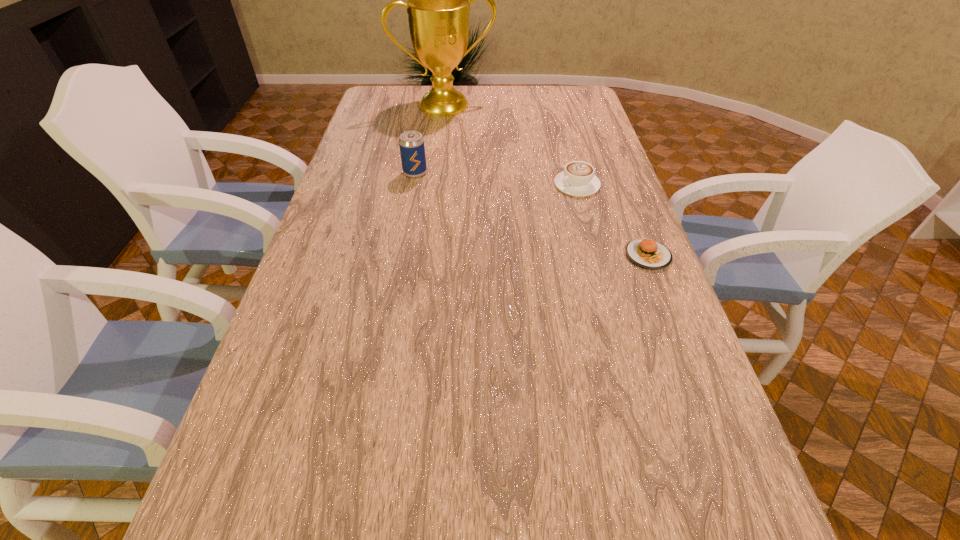
Where is `free space at the far edge of the desktop`? This screenshot has width=960, height=540. free space at the far edge of the desktop is located at coordinates (548, 87).

Where is `free spot at the near edge of the desktop`? The height and width of the screenshot is (540, 960). free spot at the near edge of the desktop is located at coordinates (602, 485).

At what (x,y) coordinates should I click in order to perform the action: click on vacant space at the left edge of the desktop. Please return your answer as a coordinate pair (x, y). The width and height of the screenshot is (960, 540). Looking at the image, I should click on (381, 145).

At what (x,y) coordinates should I click in order to perform the action: click on vacant region at the right edge of the desktop. Please return your answer as a coordinate pair (x, y). Looking at the image, I should click on 597,197.

I want to click on free space at the near left corner of the desktop, so click(x=252, y=450).

Locate an element on the screen. The width and height of the screenshot is (960, 540). free spot between the farthest object and the rightmost object is located at coordinates (547, 180).

Image resolution: width=960 pixels, height=540 pixels. What are the coordinates of `vacant area between the cappuccino and the beer can` in the screenshot? It's located at (496, 179).

Where is `blank region between the cappuccino and the food`? blank region between the cappuccino and the food is located at coordinates (612, 220).

Where is `vacant point located between the second object from right to left and the shortest object`? Image resolution: width=960 pixels, height=540 pixels. vacant point located between the second object from right to left and the shortest object is located at coordinates point(612,220).

Where is `vacant space in between the third object from left to right and the shortest object`? vacant space in between the third object from left to right and the shortest object is located at coordinates (612, 220).